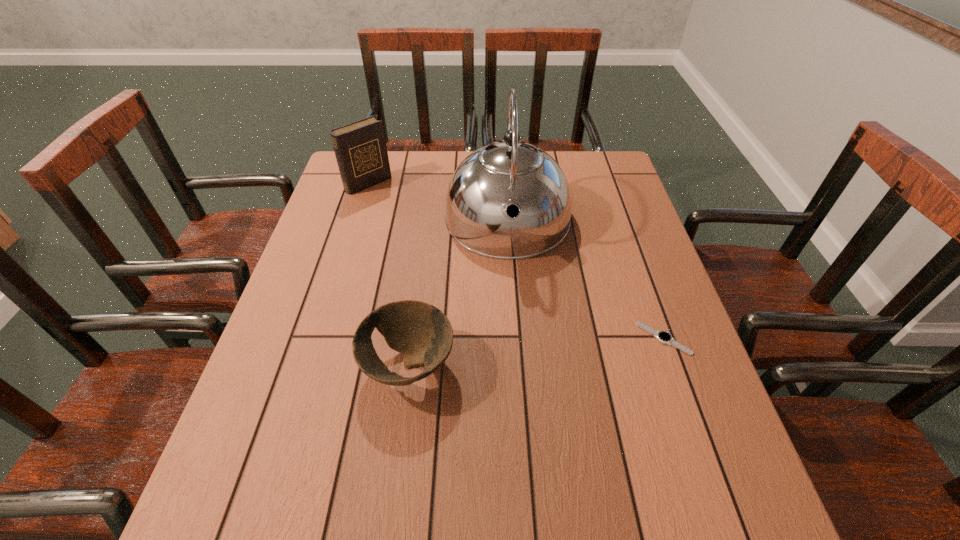
The image size is (960, 540). What are the coordinates of `vacant space at the near edge of the desktop` in the screenshot? It's located at (527, 452).

Find the location of a particular element. The height and width of the screenshot is (540, 960). vacant space at the left edge of the desktop is located at coordinates (346, 336).

The height and width of the screenshot is (540, 960). In the image, there is a desktop. What are the coordinates of `vacant space at the right edge` in the screenshot? It's located at (645, 418).

The image size is (960, 540). In the image, there is a desktop. What are the coordinates of `vacant area at the near right corner` in the screenshot? It's located at (692, 457).

This screenshot has height=540, width=960. I want to click on vacant area between the third shortest object and the rightmost object, so click(x=516, y=261).

Identify the location of empty space that is in between the kettle and the second shortest object. (458, 294).

This screenshot has height=540, width=960. I want to click on blank region between the second shortest object and the rightmost object, so (x=536, y=352).

I want to click on empty location between the diary and the bowl, so click(389, 274).

This screenshot has height=540, width=960. What are the coordinates of `free point between the shortest object and the diary` in the screenshot? It's located at (516, 261).

This screenshot has height=540, width=960. Find the location of `free space between the rightmost object and the bowl`. free space between the rightmost object and the bowl is located at coordinates (536, 352).